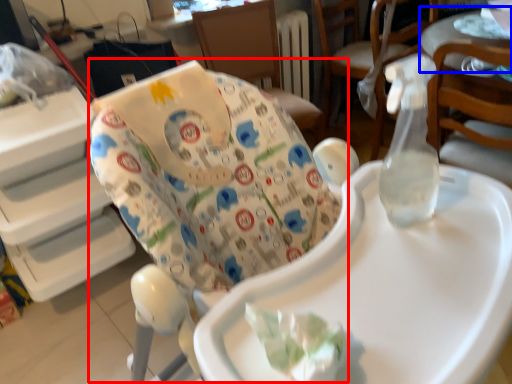
Question: Which of the following is the farthest to the observer, rocking chair (highlighted by a red box) or table (highlighted by a blue box)?

Choices:
 (A) rocking chair
 (B) table

Answer: (B)